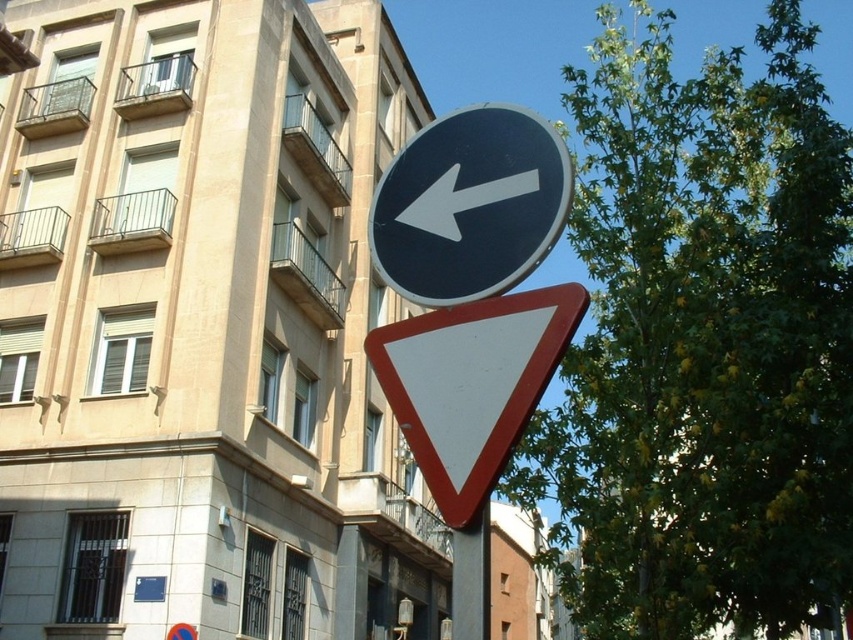
You are driving a car and see the white glossy arrow at upper center and the metallic pole at center. Which object is higher up in the image?

The white glossy arrow at upper center is positioned over the metallic pole at center, so it is higher up in the image.

Based on the photo, you are a driver approaching an intersection and see the black plastic sign at upper center and the metallic pole at center. Which object appears bigger to you?

The black plastic sign at upper center is larger in size than the metallic pole at center, so it appears bigger to you.